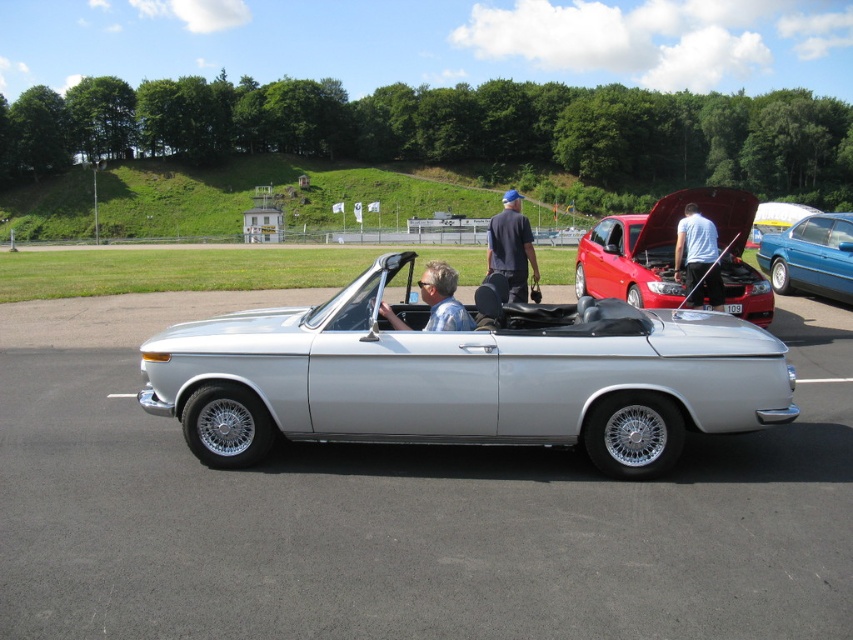
Question: Among these points, which one is farthest from the camera?

Choices:
 (A) (392, 320)
 (B) (395, 256)

Answer: (A)

Question: Does silver metallic convertible at center appear on the right side of blue denim jeans at center?

Choices:
 (A) no
 (B) yes

Answer: (A)

Question: Which object appears farthest from the camera in this image?

Choices:
 (A) blue denim jeans at center
 (B) shiny red car at center

Answer: (B)

Question: Is blue denim jeans at center smaller than white cotton shirt at center?

Choices:
 (A) no
 (B) yes

Answer: (A)

Question: Which point is farther from the camera taking this photo?

Choices:
 (A) (496, 264)
 (B) (552, 333)
 (C) (738, 257)

Answer: (C)

Question: Can you confirm if shiny red car at center is positioned below blue metallic sedan at center?

Choices:
 (A) no
 (B) yes

Answer: (B)